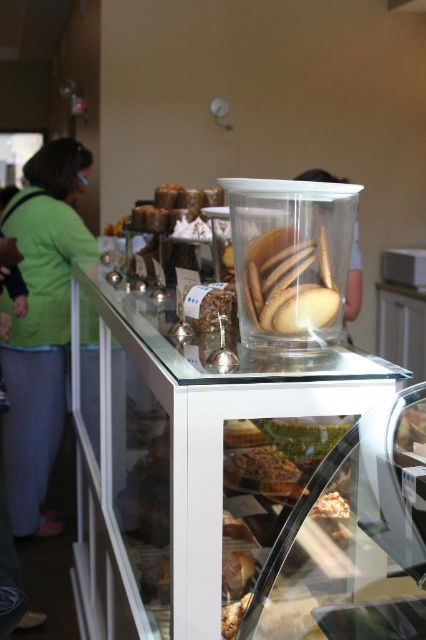
Can you confirm if green fabric jacket at left is positioned above golden brown flaky pastry at center?

Yes, green fabric jacket at left is above golden brown flaky pastry at center.

Is green fabric jacket at left taller than golden brown flaky pastry at center?

Correct, green fabric jacket at left is much taller as golden brown flaky pastry at center.

Does point (46, 188) lie in front of point (314, 506)?

That is False.

Locate an element on the screen. green fabric jacket at left is located at coordinates (42, 324).

Which of these two, green fabric jacket at left or translucent plastic cookies at center, stands taller?

green fabric jacket at left

Does point (11, 202) lie behind point (316, 268)?

That is True.

The width and height of the screenshot is (426, 640). Find the location of `green fabric jacket at left`. green fabric jacket at left is located at coordinates [x=42, y=324].

Is green fabric jacket at left bigger than translucent glass cookies at center?

Indeed, green fabric jacket at left has a larger size compared to translucent glass cookies at center.

Who is more distant from viewer, (x=23, y=337) or (x=347, y=291)?

The point (x=23, y=337) is more distant.

Who is more forward, (x=51, y=179) or (x=357, y=244)?

Positioned in front is point (x=51, y=179).

Find the location of a particular element. green fabric jacket at left is located at coordinates (42, 324).